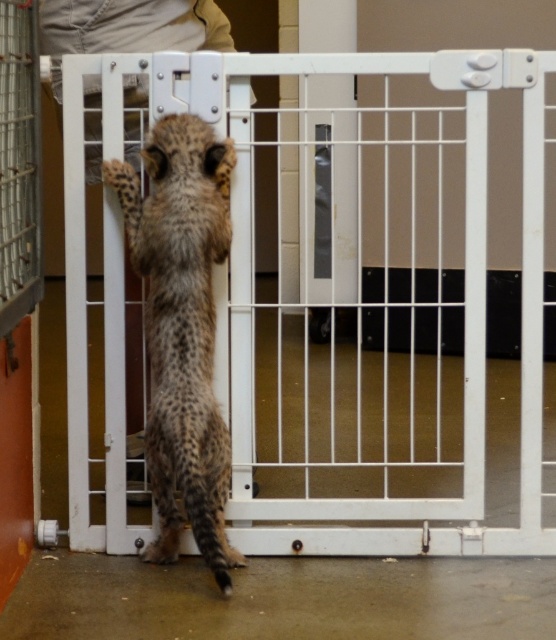
In the scene shown: Can you confirm if white wire gate at center is positioned above spotted fur cheetah at center?

Indeed, white wire gate at center is positioned over spotted fur cheetah at center.

Is white wire gate at center bigger than spotted fur cheetah at center?

Indeed, white wire gate at center has a larger size compared to spotted fur cheetah at center.

Between point (539, 323) and point (146, 339), which one is positioned in front?

Point (146, 339)

The width and height of the screenshot is (556, 640). In order to click on white wire gate at center in this screenshot , I will do [349, 301].